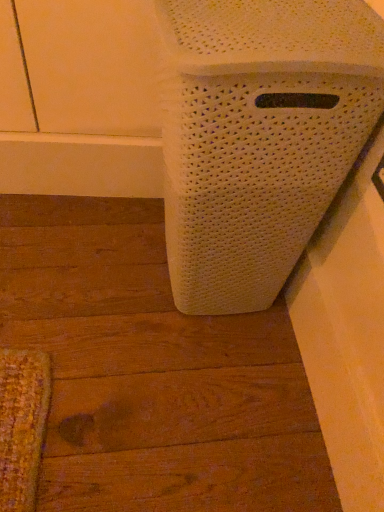
Describe the element at coordinates (258, 137) in the screenshot. The height and width of the screenshot is (512, 384). I see `white woven basket at center` at that location.

Find the location of a particular element. This screenshot has height=512, width=384. white woven basket at center is located at coordinates (258, 137).

You are a GUI agent. You are given a task and a screenshot of the screen. Output one action in this format:
    pyautogui.click(x=<x>, y=<y>)
    Task: Click on the white woven basket at center
    
    Given the screenshot: What is the action you would take?
    pyautogui.click(x=258, y=137)